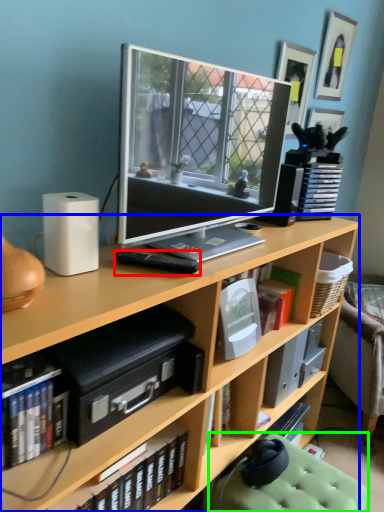
Question: Estimate the real-world distances between objects in this image. Which object is farther from remote control (highlighted by a red box), bookcase (highlighted by a blue box) or swivel chair (highlighted by a green box)?

Choices:
 (A) bookcase
 (B) swivel chair

Answer: (B)